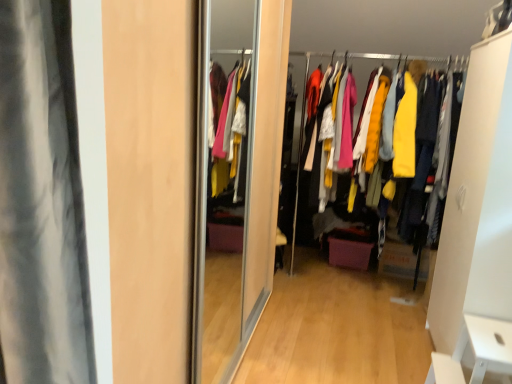
The width and height of the screenshot is (512, 384). What do you see at coordinates (425, 67) in the screenshot?
I see `textured fabric clothes at center` at bounding box center [425, 67].

This screenshot has height=384, width=512. Identify the location of textured fabric clothes at center. (425, 67).

Where is `textured fabric clothes at center`? The height and width of the screenshot is (384, 512). textured fabric clothes at center is located at coordinates (425, 67).